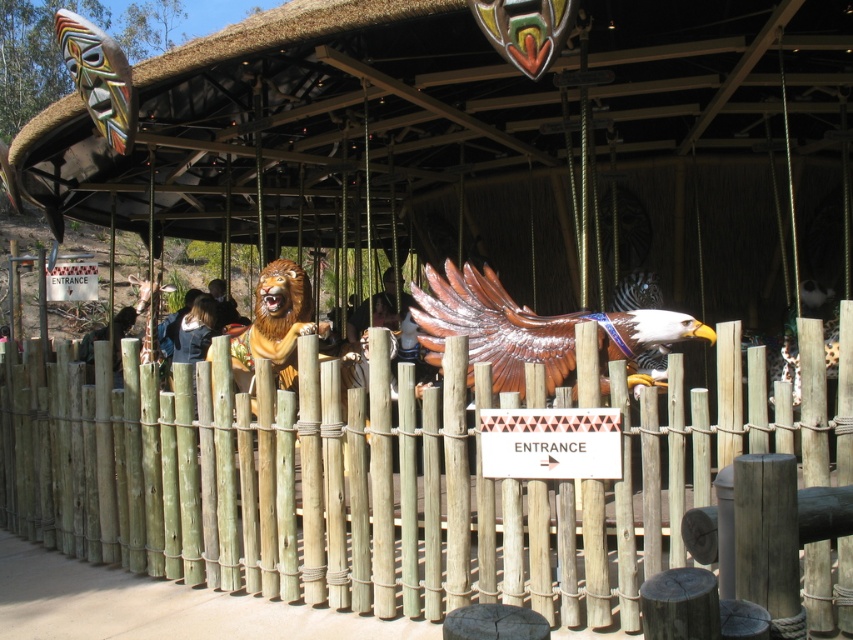
Question: Is brown wooden eagle at center below smooth brown hair at center?

Choices:
 (A) no
 (B) yes

Answer: (B)

Question: Considering the real-world distances, which object is closest to the brown wooden eagle at center?

Choices:
 (A) green bamboo fence at center
 (B) smooth brown hair at center

Answer: (A)

Question: Does brown wooden eagle at center have a greater width compared to smooth brown hair at center?

Choices:
 (A) no
 (B) yes

Answer: (B)

Question: Which point is closer to the camera taking this photo?

Choices:
 (A) (457, 275)
 (B) (792, 561)

Answer: (B)

Question: In this image, where is brown wooden eagle at center located relative to smooth brown hair at center?

Choices:
 (A) above
 (B) below

Answer: (B)

Question: Considering the real-world distances, which object is closest to the green bamboo fence at center?

Choices:
 (A) brown wooden eagle at center
 (B) smooth brown hair at center

Answer: (A)